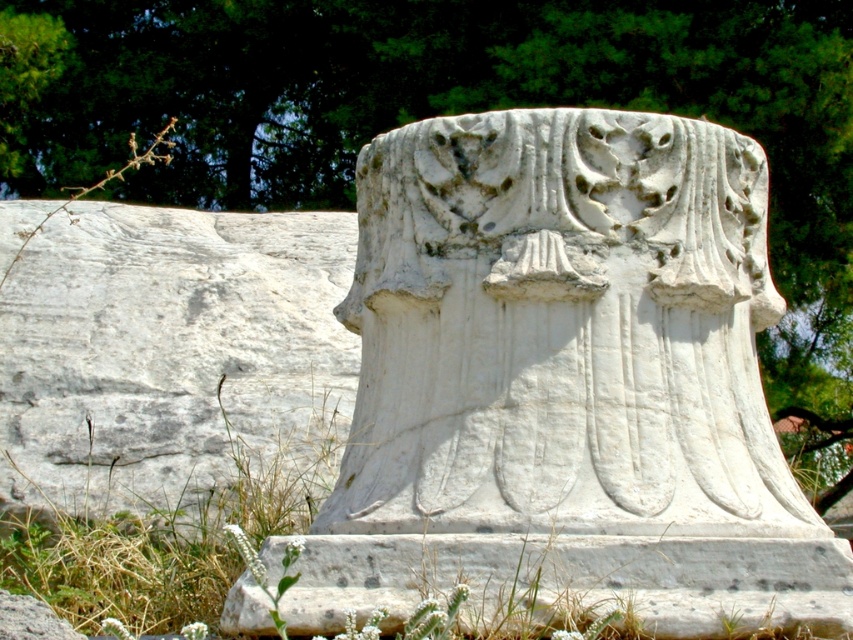
Question: Which point appears closest to the camera in this image?

Choices:
 (A) (476, 323)
 (B) (279, 481)

Answer: (A)

Question: Which of the following is the farthest from the observer?

Choices:
 (A) (701, 381)
 (B) (144, 512)

Answer: (B)

Question: Is white marble column at center further to the viewer compared to dry grass at lower left?

Choices:
 (A) yes
 (B) no

Answer: (B)

Question: Is white marble column at center to the right of dry grass at lower left from the viewer's perspective?

Choices:
 (A) no
 (B) yes

Answer: (B)

Question: Does white marble column at center have a lesser width compared to dry grass at lower left?

Choices:
 (A) no
 (B) yes

Answer: (A)